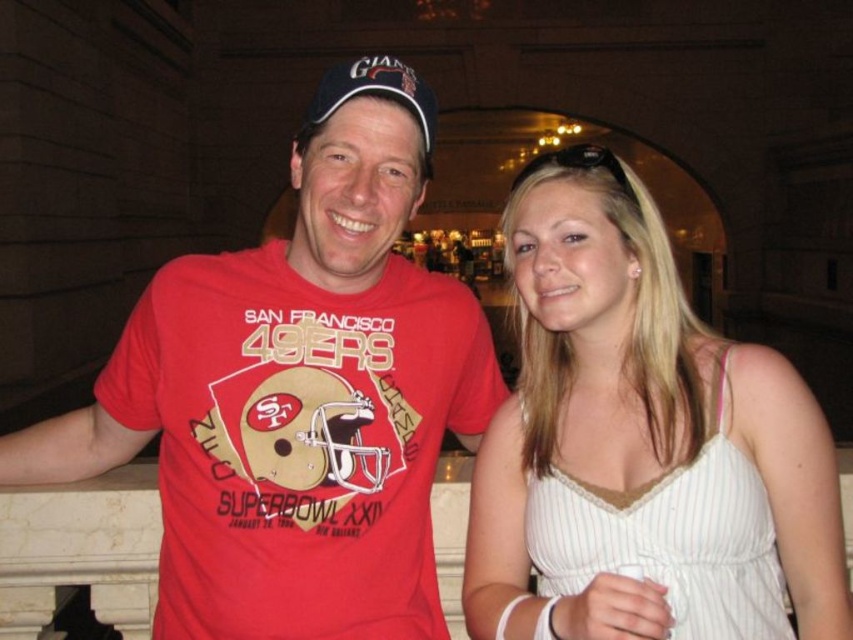
Can you confirm if white striped dress at center is thinner than blue fabric baseball cap at center?

Yes, white striped dress at center is thinner than blue fabric baseball cap at center.

Describe the element at coordinates (631, 422) in the screenshot. I see `white striped dress at center` at that location.

Identify the location of white striped dress at center. (631, 422).

Who is lower down, red matte t-shirt at center or blue fabric baseball cap at center?

Positioned lower is red matte t-shirt at center.

Does red matte t-shirt at center appear on the left side of blue fabric baseball cap at center?

In fact, red matte t-shirt at center is to the right of blue fabric baseball cap at center.

Locate an element on the screen. The width and height of the screenshot is (853, 640). red matte t-shirt at center is located at coordinates (297, 394).

Is red matte t-shirt at center smaller than white striped dress at center?

Yes, red matte t-shirt at center is smaller than white striped dress at center.

Which of these two, red matte t-shirt at center or white striped dress at center, stands taller?

With more height is white striped dress at center.

Which is behind, point (265, 330) or point (648, 467)?

Positioned behind is point (265, 330).

The height and width of the screenshot is (640, 853). In order to click on red matte t-shirt at center in this screenshot , I will do click(297, 394).